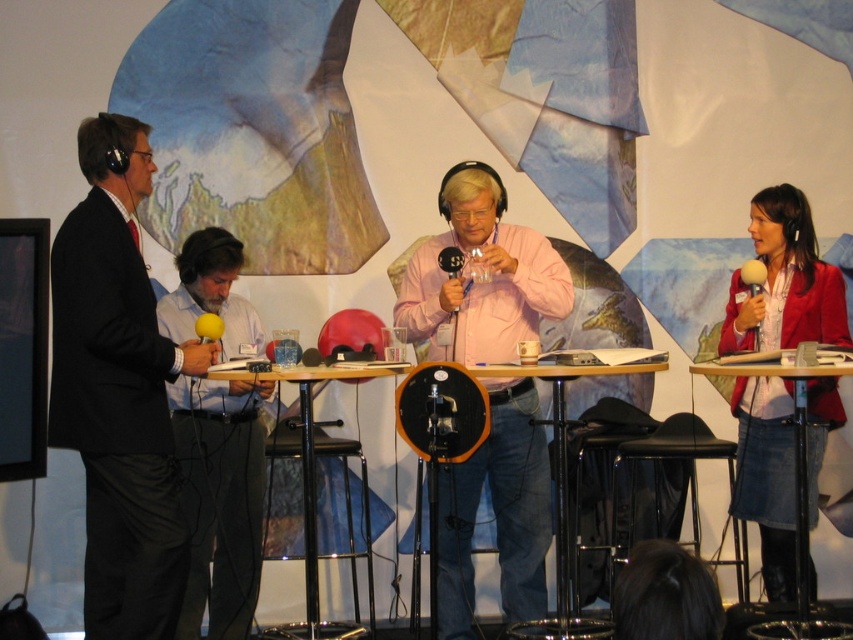
Based on the scene description, which object is taller between the pink matte shirt at center and the wooden table at center?

The pink matte shirt at center is much taller than the wooden table at center.